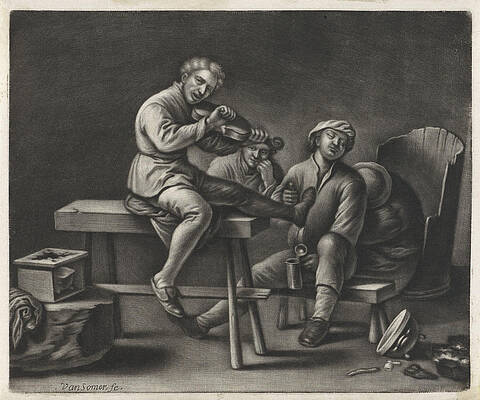
This screenshot has height=400, width=480. I want to click on chair, so click(x=424, y=184).